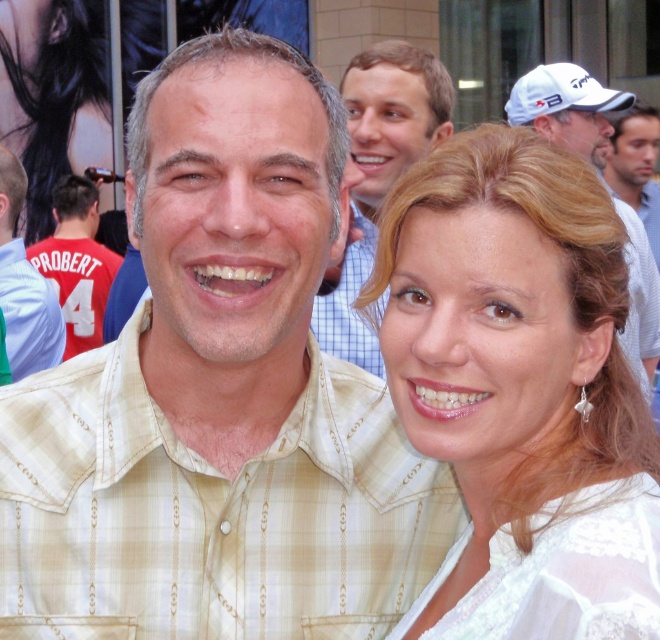
Question: Which object is farther from the camera taking this photo?

Choices:
 (A) white lace blouse at upper right
 (B) white textured cap at upper right

Answer: (B)

Question: Which point is closer to the camera taking this photo?

Choices:
 (A) (59, 310)
 (B) (595, 104)
 (C) (152, 145)
 (D) (51, 278)

Answer: (C)

Question: Does light beige plaid shirt at center appear over white cap at upper right?

Choices:
 (A) yes
 (B) no

Answer: (B)

Question: Which of the following is the farthest from the observer?

Choices:
 (A) (620, 172)
 (B) (525, 90)
 (C) (92, 256)

Answer: (A)

Question: Can you confirm if white lace blouse at upper right is thinner than white textured cap at upper right?

Choices:
 (A) yes
 (B) no

Answer: (A)

Question: Can you confirm if blue checkered shirt at upper center is positioned to the left of light blue shirt at center?

Choices:
 (A) yes
 (B) no

Answer: (B)